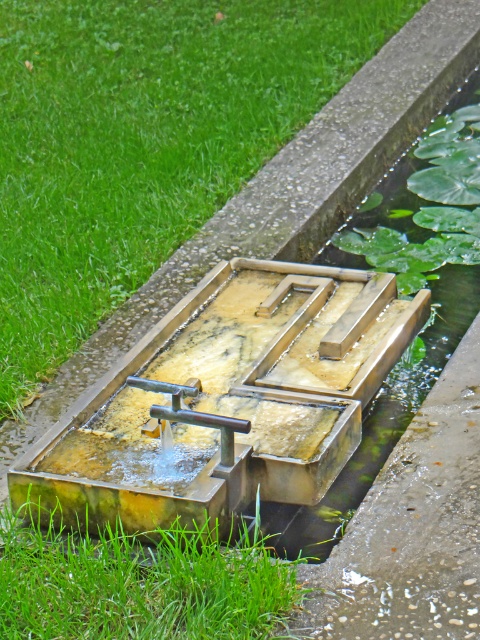
Does green grass at upper left appear under green grass at lower left?

Incorrect, green grass at upper left is not positioned below green grass at lower left.

Which of these two, green grass at upper left or green grass at lower left, stands taller?

green grass at upper left is taller.

Does point (170, 209) come farther from viewer compared to point (180, 576)?

Yes, point (170, 209) is farther from viewer.

Where is `green grass at upper left`? Image resolution: width=480 pixels, height=640 pixels. green grass at upper left is located at coordinates (143, 140).

Is green grass at lower left below polished brass faucet at center?

Yes, green grass at lower left is below polished brass faucet at center.

Between point (188, 580) and point (162, 419), which one is positioned behind?

Point (162, 419)

At what (x,y) coordinates should I click in order to perform the action: click on green grass at lower left. Please return your answer as a coordinate pair (x, y). Looking at the image, I should click on (142, 584).

Between green grass at upper left and polished brass faucet at center, which one has less height?

With less height is polished brass faucet at center.

Can you confirm if green grass at upper left is positioned to the right of polished brass faucet at center?

In fact, green grass at upper left is to the left of polished brass faucet at center.

The height and width of the screenshot is (640, 480). I want to click on green grass at upper left, so click(143, 140).

Locate an element on the screen. green grass at upper left is located at coordinates (143, 140).